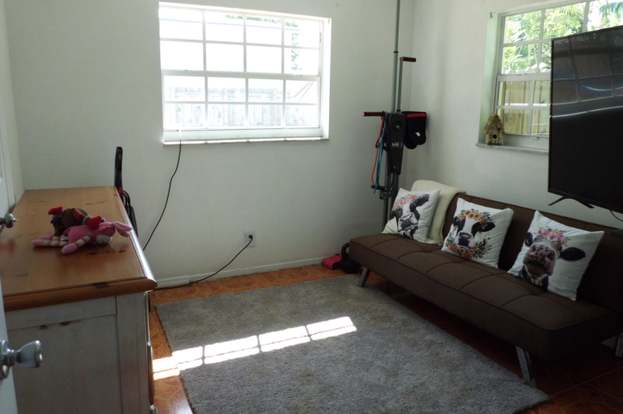
Where is `power outlet`? The height and width of the screenshot is (414, 623). power outlet is located at coordinates (253, 242).